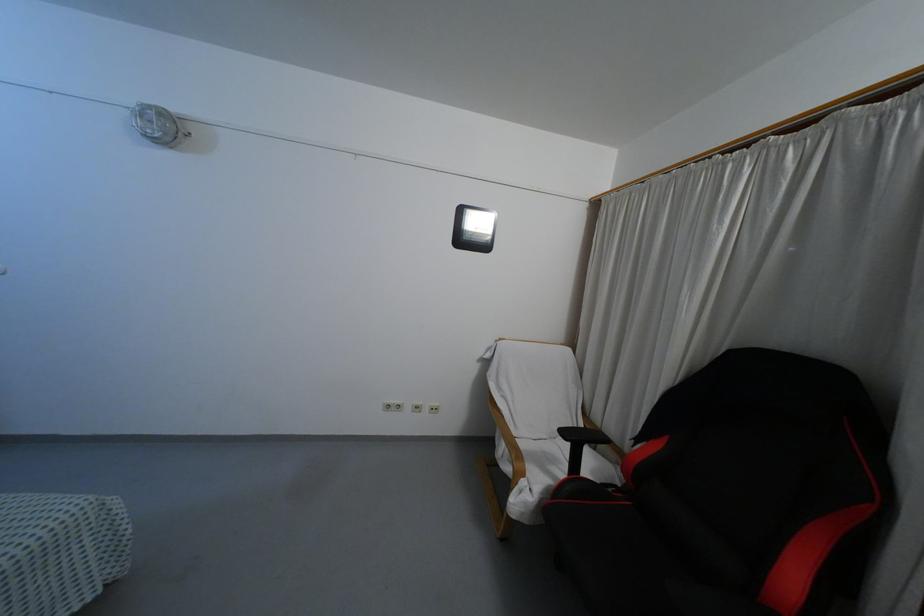
What do you see at coordinates (624, 564) in the screenshot?
I see `the black chair sitting surface` at bounding box center [624, 564].